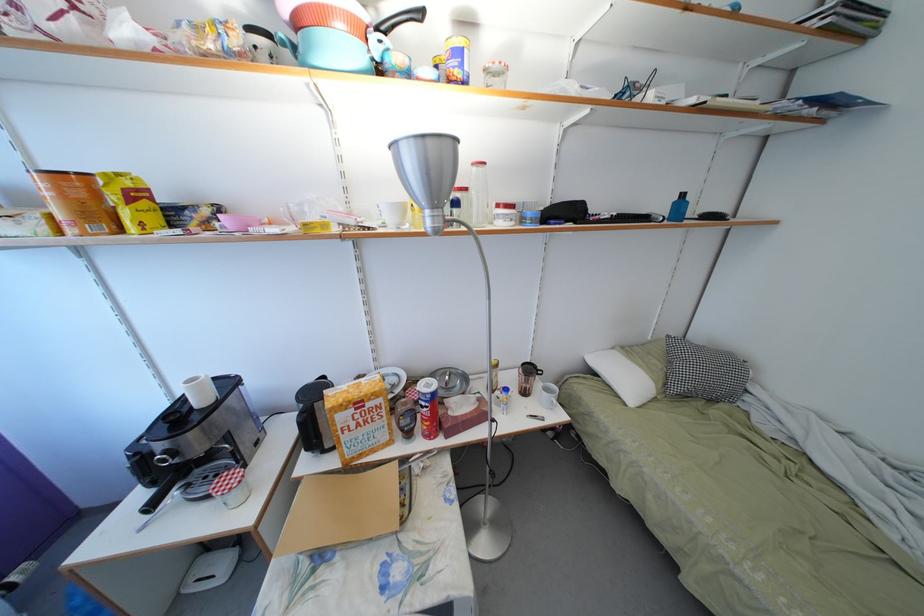
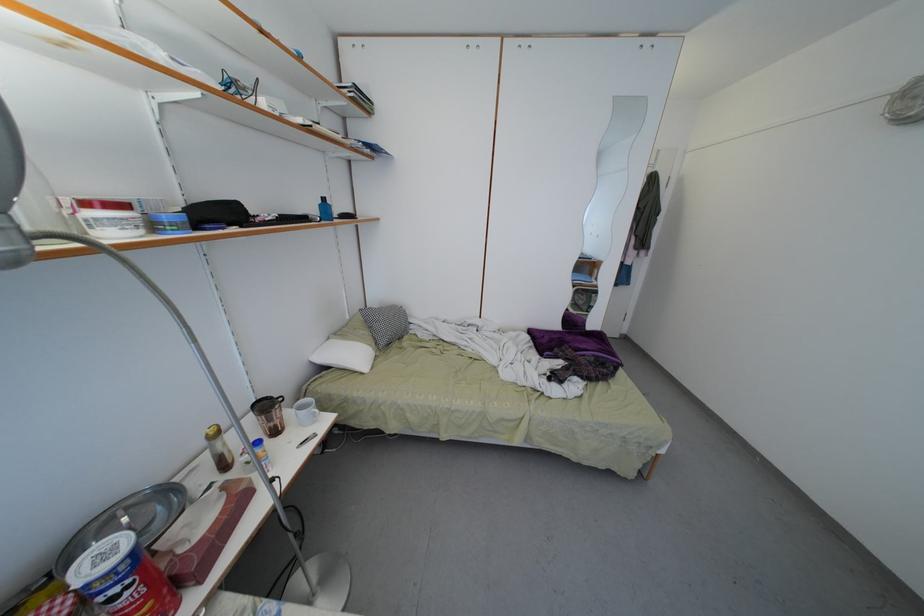
In the second image, find the point that corresponds to point (504, 211) in the first image.

(91, 209)